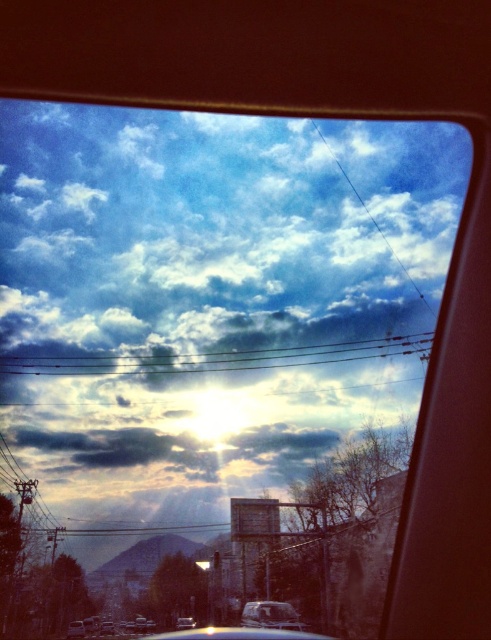
Question: Observing the image, what is the correct spatial positioning of matte silver van at center in reference to matte silver car at lower left?

Choices:
 (A) below
 (B) above

Answer: (B)

Question: Which of the following is the closest to the observer?

Choices:
 (A) matte silver van at center
 (B) matte silver car at lower left

Answer: (A)

Question: Can you confirm if matte silver van at center is thinner than matte silver car at lower left?

Choices:
 (A) no
 (B) yes

Answer: (A)

Question: Can you confirm if matte silver van at center is thinner than matte silver car at lower left?

Choices:
 (A) no
 (B) yes

Answer: (A)

Question: Which of the following is the farthest from the observer?

Choices:
 (A) matte silver car at lower left
 (B) matte silver van at center

Answer: (A)

Question: Which point is farther from the camera taking this photo?

Choices:
 (A) (83, 627)
 (B) (273, 608)

Answer: (A)